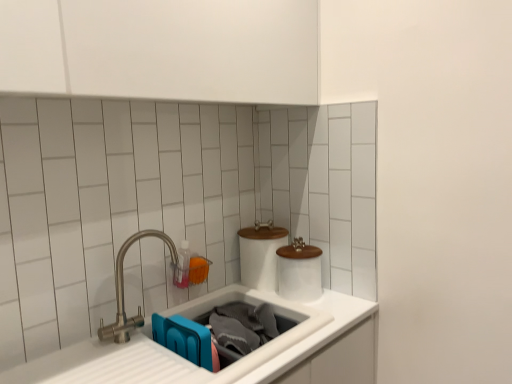
I want to click on free space in front of white glossy toilet paper at center, placed as the first toilet paper when sorted from right to left, so click(x=311, y=308).